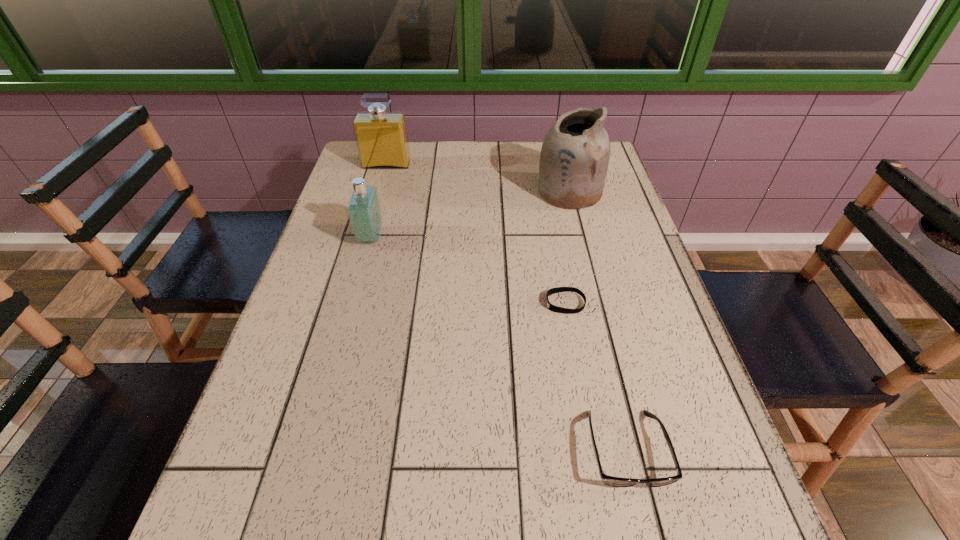
In order to click on object present at the far right corner in this screenshot , I will do `click(574, 158)`.

The width and height of the screenshot is (960, 540). Identify the location of vacant space at the far edge of the desktop. (517, 179).

Locate an element on the screen. vacant space at the near edge is located at coordinates (373, 534).

In order to click on free space at the left edge of the desktop in this screenshot , I will do `click(276, 517)`.

Where is `blank area at the right edge`? The height and width of the screenshot is (540, 960). blank area at the right edge is located at coordinates 599,225.

Locate an element on the screen. Image resolution: width=960 pixels, height=540 pixels. free space at the far left corner of the desktop is located at coordinates pos(389,172).

This screenshot has width=960, height=540. What are the coordinates of `free space that is in between the third nearest object and the nearest object` in the screenshot? It's located at (498, 343).

Where is `unoccupied area between the fourth farthest object and the spectacles`? The width and height of the screenshot is (960, 540). unoccupied area between the fourth farthest object and the spectacles is located at coordinates (595, 376).

Locate an element on the screen. free point between the second shortest object and the pottery is located at coordinates (597, 321).

I want to click on free spot between the pottery and the wristband, so click(567, 247).